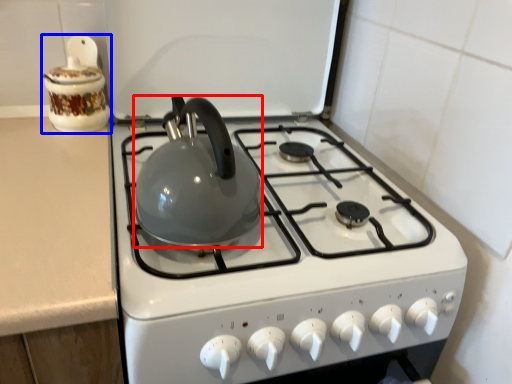
Question: Which object appears farthest to the camera in this image, kettle (highlighted by a red box) or kitchen appliance (highlighted by a blue box)?

Choices:
 (A) kettle
 (B) kitchen appliance

Answer: (B)